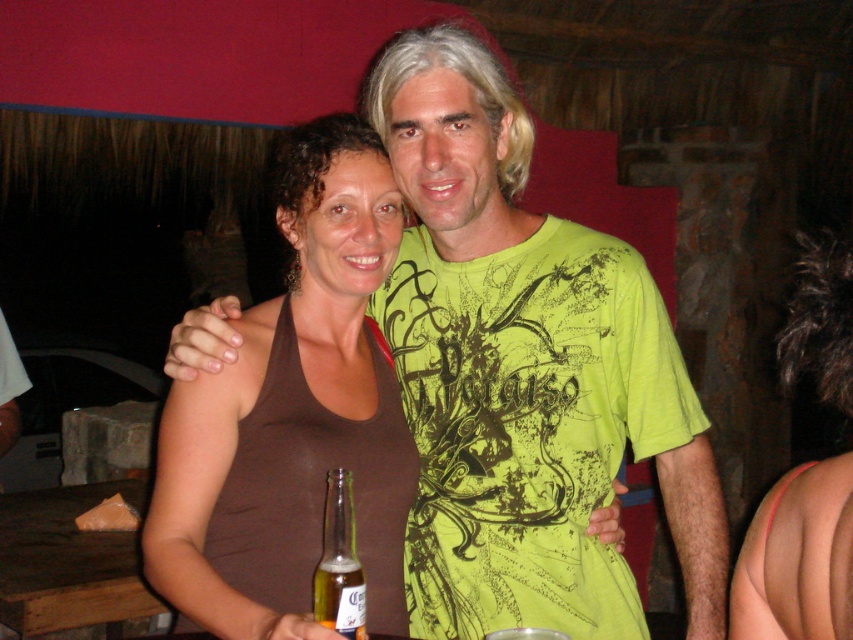
You are a photographer trying to focus on the brown fabric tank top at center. The camera can only focus on objects within a radius of 0.3 units from the point at coordinates point (292, 413). Is the brown fabric tank top at center within the focus range?

The point (292, 413) corresponds to the brown fabric tank top at center, so yes, the brown fabric tank top at center is within the focus range since the focus radius is centered at that point.

From the picture: You are at a party and see two bottles, a translucent glass bottle at lower center and a gold glass bottle at lower center. Which one is positioned higher?

The translucent glass bottle at lower center is positioned higher than the gold glass bottle at lower center.

You are a photographer trying to capture a closeup shot of the gold glass bottle at lower center without the brown fabric tank top at center blocking the view. Is the bottle small enough to fit within the frame while avoiding the tank top?

The gold glass bottle at lower center is smaller than the brown fabric tank top at center, so it might be possible to position the camera to focus on the bottle while keeping the tank top out of the frame. However, the exact feasibility depends on the camera angle and distance.